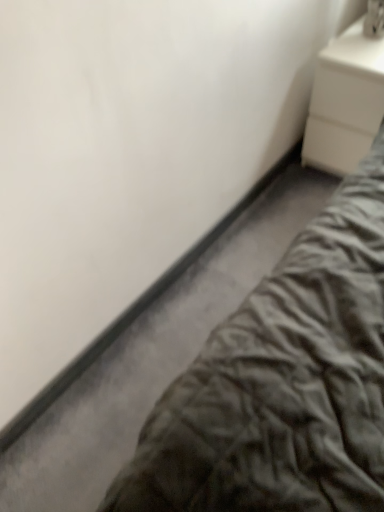
The image size is (384, 512). I want to click on blank space situated above velvet gray bed at lower right (from a real-world perspective), so pos(211,284).